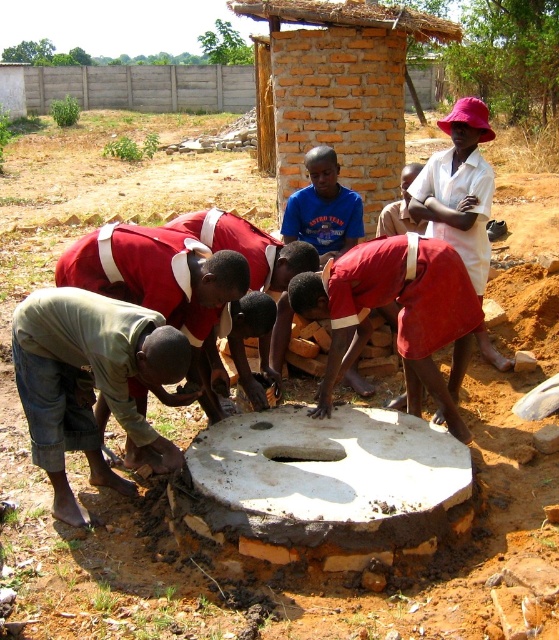
Question: Is light green fabric shirt at lower left thinner than light brown wooden stick at center?

Choices:
 (A) no
 (B) yes

Answer: (A)

Question: Which object is closer to the camera taking this photo?

Choices:
 (A) green fabric shirt at lower left
 (B) light green fabric shirt at lower left
 (C) blue t-shirt at center
 (D) red fabric shirt at center

Answer: (B)

Question: Which object is farther from the camera taking this photo?

Choices:
 (A) blue t-shirt at center
 (B) light brown wooden stick at center
 (C) green fabric shirt at lower left
 (D) light green fabric shirt at lower left

Answer: (B)

Question: Does green fabric shirt at lower left have a greater width compared to blue t-shirt at center?

Choices:
 (A) yes
 (B) no

Answer: (A)

Question: Does red fabric shirt at center appear on the right side of blue t-shirt at center?

Choices:
 (A) yes
 (B) no

Answer: (A)

Question: Which object appears farthest from the camera in this image?

Choices:
 (A) green fabric shirt at lower left
 (B) red fabric shirt at center
 (C) light green fabric shirt at lower left

Answer: (B)